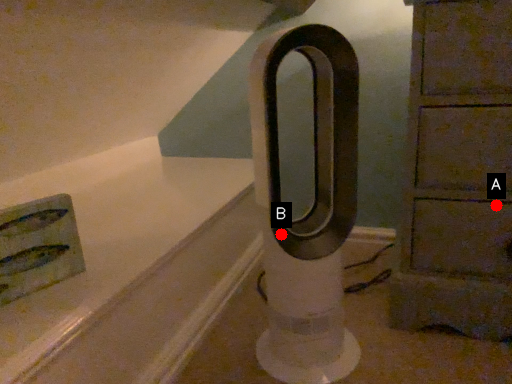
Question: Two points are circled on the image, labeled by A and B beside each circle. Which point is closer to the camera taking this photo?

Choices:
 (A) A is closer
 (B) B is closer

Answer: (B)